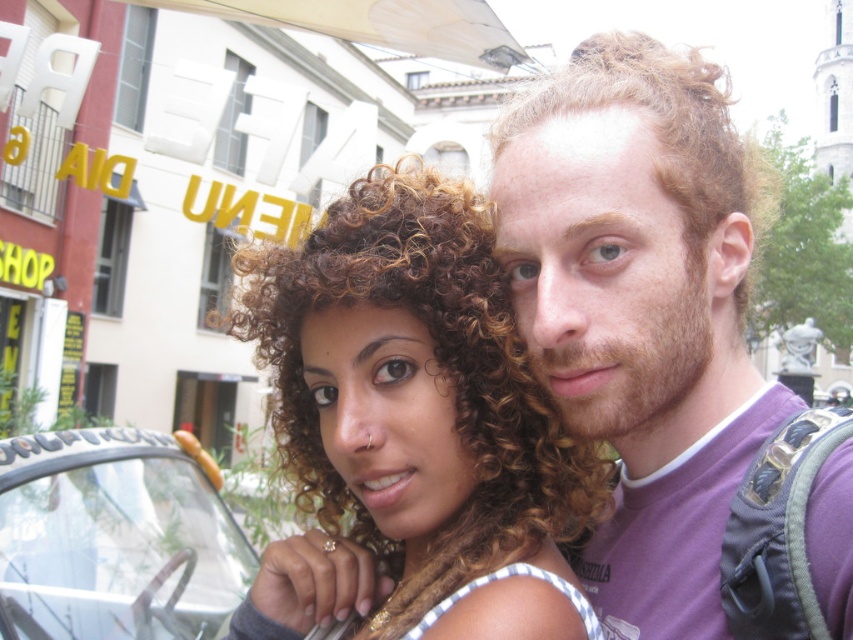
You are a photographer trying to focus on two points in the image. The first point is at coordinates point (675,378), and the second is at point (202,625). Which point should you focus on first if you want to start with the one closer to the camera?

Point (675,378) is closer to the camera than point (202,625), so you should focus on point (675,378) first.

You are standing in the scene and want to take a photo of the curly hair at center. The camera you have can only focus on objects within a 0.1 unit radius around point (x=413, y=426). Is the curly hair at center within this focus range?

The curly hair at center is exactly at point (x=413, y=426), so it will be within the camera focus range of 0.1 unit radius around that point.